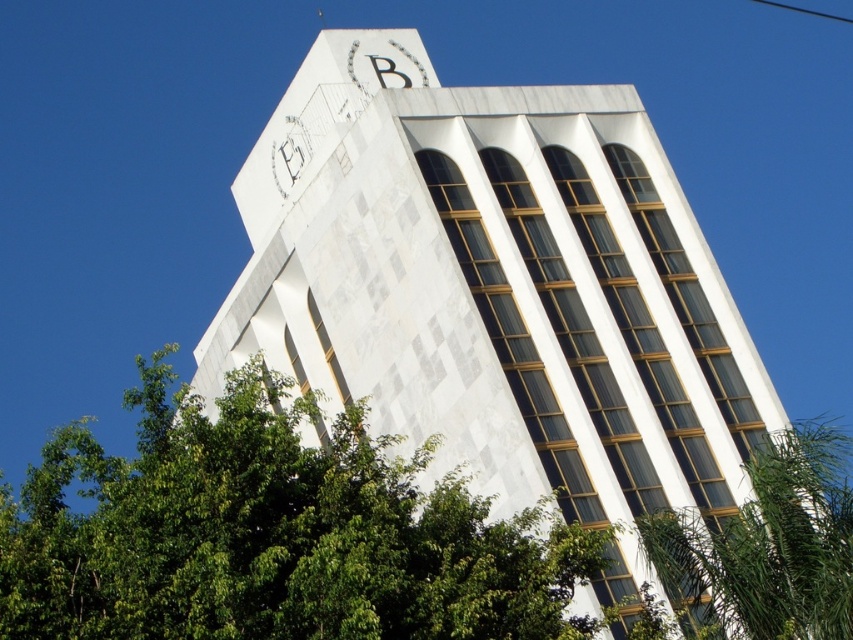
Question: Observing the image, what is the correct spatial positioning of white marble tower at center in reference to green leafy tree at lower left?

Choices:
 (A) left
 (B) right

Answer: (B)

Question: Is white marble tower at center wider than white marble clock at upper center?

Choices:
 (A) no
 (B) yes

Answer: (B)

Question: Does white marble tower at center have a lesser width compared to white marble clock at upper center?

Choices:
 (A) yes
 (B) no

Answer: (B)

Question: Among these points, which one is nearest to the camera?

Choices:
 (A) [x=325, y=625]
 (B) [x=502, y=470]

Answer: (A)

Question: Estimate the real-world distances between objects in this image. Which object is closer to the white marble tower at center?

Choices:
 (A) green leafy tree at lower left
 (B) white marble clock at upper center
 (C) green leafy tree at lower right

Answer: (A)

Question: Which object is the farthest from the green leafy tree at lower right?

Choices:
 (A) green leafy tree at lower left
 (B) white marble clock at upper center

Answer: (B)